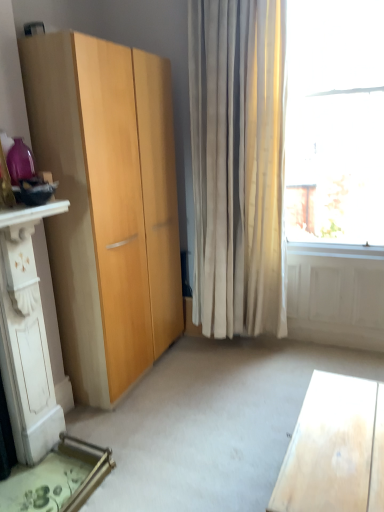
Question: Based on their sizes in the image, would you say light wood desk at lower right is bigger or smaller than white carved wood dresser at lower left?

Choices:
 (A) small
 (B) big

Answer: (A)

Question: From a real-world perspective, is light wood desk at lower right above or below white carved wood dresser at lower left?

Choices:
 (A) above
 (B) below

Answer: (B)

Question: Relative to white carved wood dresser at lower left, is light wood desk at lower right in front or behind?

Choices:
 (A) front
 (B) behind

Answer: (A)

Question: Looking at their shapes, would you say white carved wood dresser at lower left is wider or thinner than light wood desk at lower right?

Choices:
 (A) wide
 (B) thin

Answer: (A)

Question: Visually, is white carved wood dresser at lower left positioned to the left or to the right of light wood desk at lower right?

Choices:
 (A) left
 (B) right

Answer: (A)

Question: In the image, is white carved wood dresser at lower left positioned in front of or behind light wood desk at lower right?

Choices:
 (A) behind
 (B) front

Answer: (A)

Question: In terms of size, does white carved wood dresser at lower left appear bigger or smaller than light wood desk at lower right?

Choices:
 (A) small
 (B) big

Answer: (B)